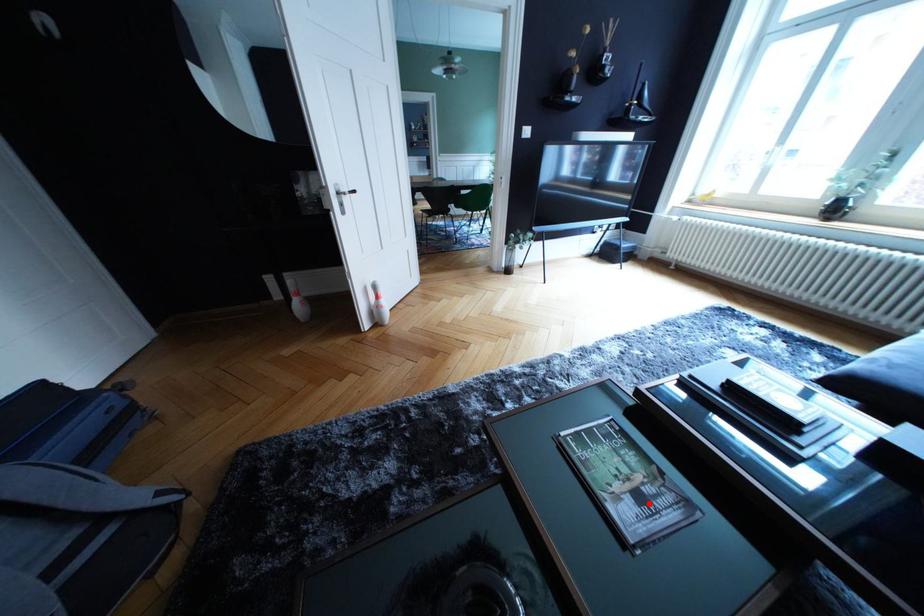
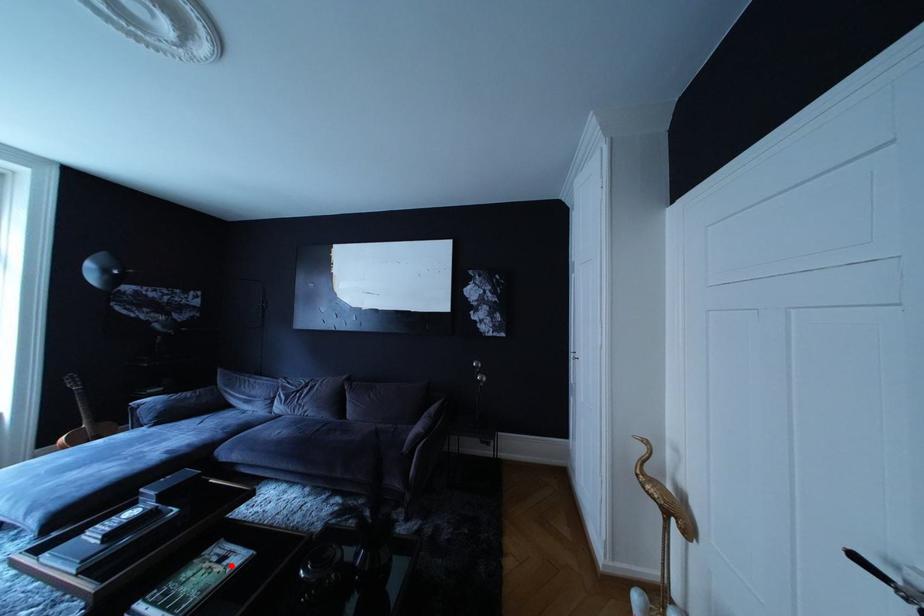
I am providing you with two images of the same scene from different viewpoints. A red point is marked on the first image and another point is marked on the second image. Does the point marked in image1 correspond to the same location as the one in image2?

Yes